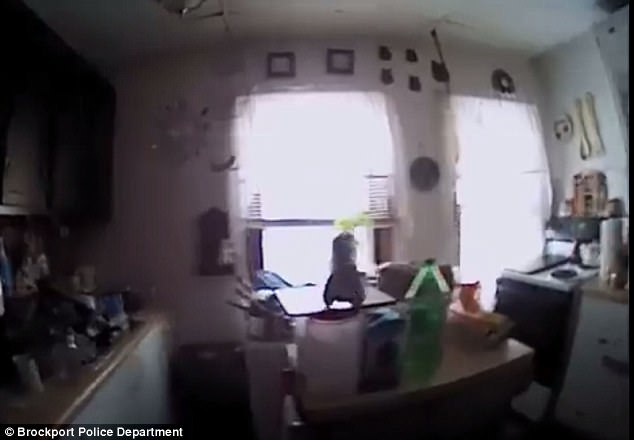
Locate an element on the screen. The height and width of the screenshot is (440, 634). place to cook is located at coordinates (558, 265).